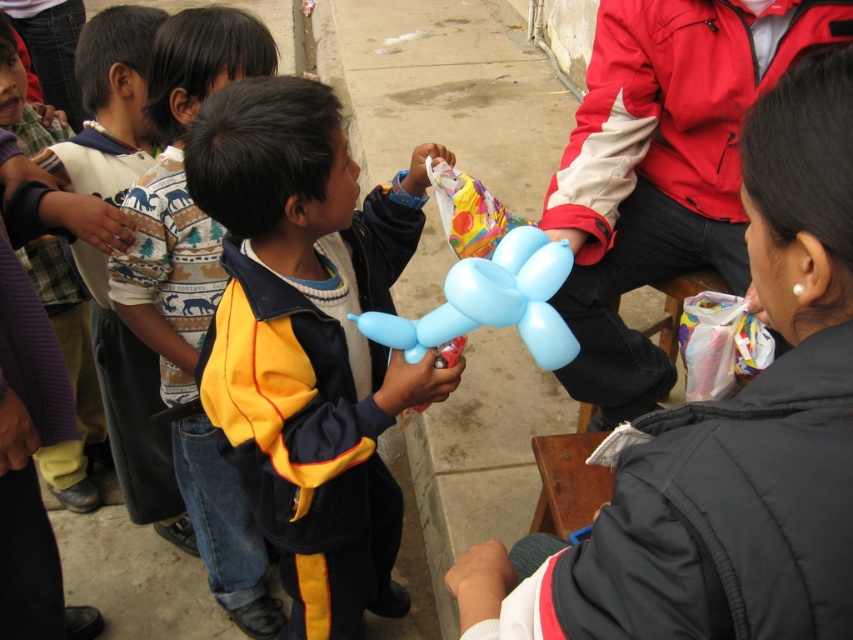
You are standing in the street scene and want to place a new object between the two points, point 1 at coordinates point (306, 416) and point 2 at coordinates point (260, 612). Which point should the new object be closer to in order to appear closer to you?

The new object should be placed closer to point (306, 416) because it is closer to the viewer than point (260, 612).

You are a photographer standing at the back of the scene. You want to take a photo that includes both the yellow matte jacket at center and the knitted sweater at left. The minimum distance between them in the photo should be 25 inches. Can you capture them both in the same frame without moving either object?

The yellow matte jacket at center is 27.19 inches from the knitted sweater at left. Since 27.19 inches is greater than the required 25 inches, you can capture both in the same frame as they are already spaced apart by more than the minimum distance.

You are a photographer trying to capture a photo of the yellow matte jacket at center and the knitted sweater at left. Based on their positions, which object should you focus on first to ensure both are in frame?

The yellow matte jacket at center is located below the knitted sweater at left, so you should focus on the knitted sweater at left first to ensure both are in frame.